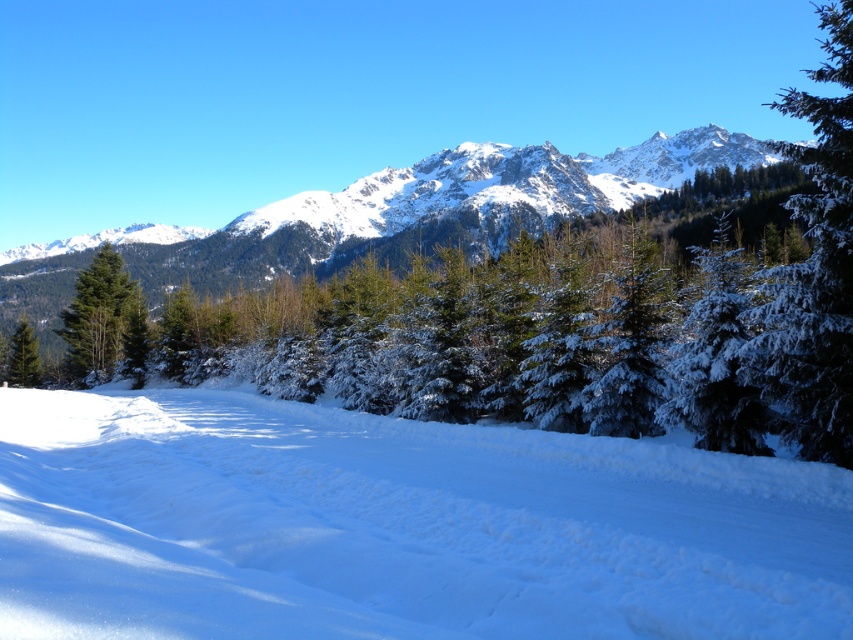
Question: Which is farther from the snow-covered evergreen at right?

Choices:
 (A) snowy rocky mountain at upper center
 (B) white snow at lower center
 (C) green matte tree at left

Answer: (A)

Question: Can you confirm if white snow at lower center is positioned above snow-covered evergreen at right?

Choices:
 (A) no
 (B) yes

Answer: (A)

Question: Which point appears farthest from the camera in this image?

Choices:
 (A) (839, 317)
 (B) (326, 435)

Answer: (B)

Question: Considering the real-world distances, which object is farthest from the snow-covered evergreen at right?

Choices:
 (A) snowy rocky mountain at upper center
 (B) white snow at lower center

Answer: (A)

Question: Is white snow at lower center behind snowy rocky mountain at upper center?

Choices:
 (A) no
 (B) yes

Answer: (A)

Question: Does snowy rocky mountain at upper center have a greater width compared to snow-covered evergreen at right?

Choices:
 (A) no
 (B) yes

Answer: (B)